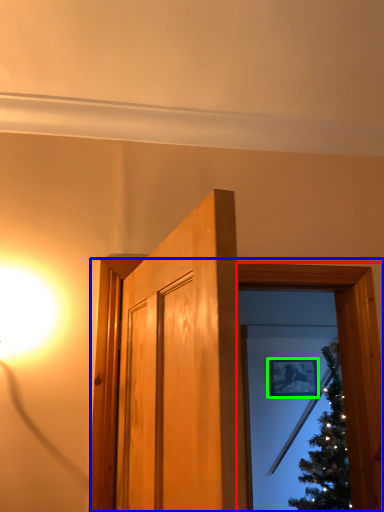
Question: Which object is positioned closest to window frame (highlighted by a red box)? Select from window frame (highlighted by a blue box) and picture frame (highlighted by a green box).

Choices:
 (A) window frame
 (B) picture frame

Answer: (A)